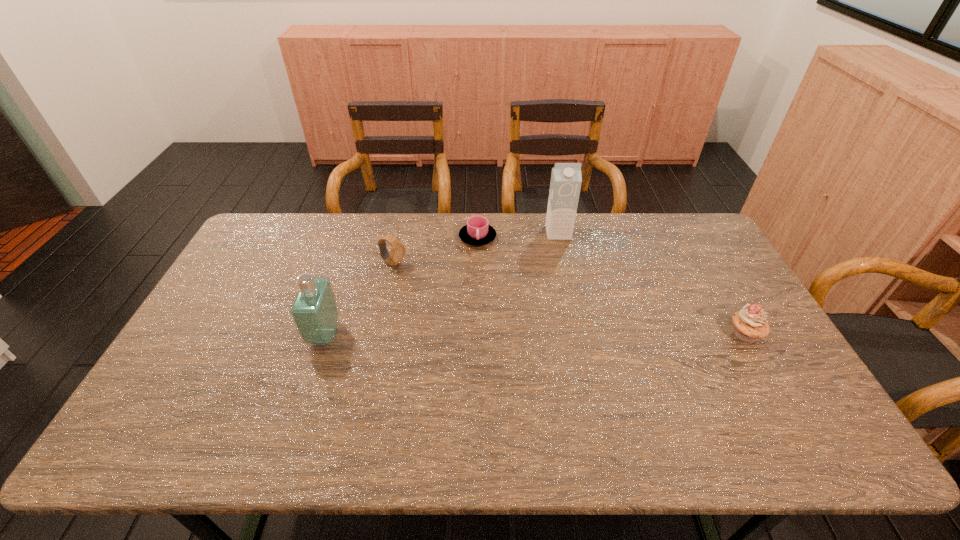
I want to click on the closest object to the rightmost object, so click(x=566, y=179).

You are a GUI agent. You are given a task and a screenshot of the screen. Output one action in this format:
    pyautogui.click(x=<x>, y=<y>)
    Task: Click on the object that is the closest one to the third nearest object
    This screenshot has width=960, height=540.
    Given the screenshot: What is the action you would take?
    pyautogui.click(x=477, y=232)

The height and width of the screenshot is (540, 960). What are the coordinates of `free spot that satisfies the following two spatial constraints: 1. on the back side of the shortest object; 2. on the right side of the tallest object` in the screenshot? It's located at pos(478,233).

This screenshot has width=960, height=540. I want to click on vacant space that satisfies the following two spatial constraints: 1. on the front side of the watch; 2. on the left side of the cupcake, so click(x=378, y=334).